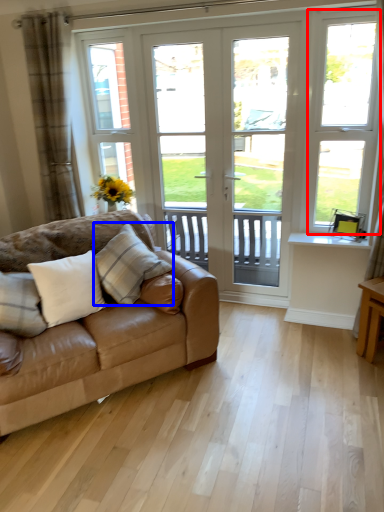
Question: Which point is further to the camera, window frame (highlighted by a red box) or pillow (highlighted by a blue box)?

Choices:
 (A) window frame
 (B) pillow

Answer: (A)